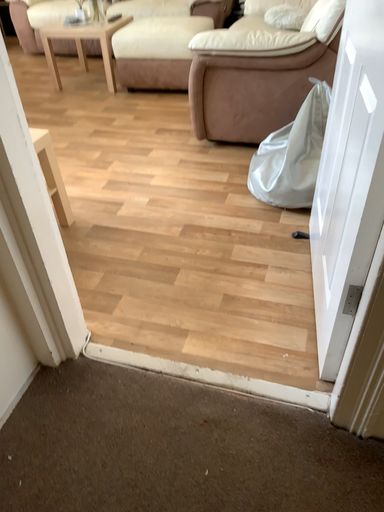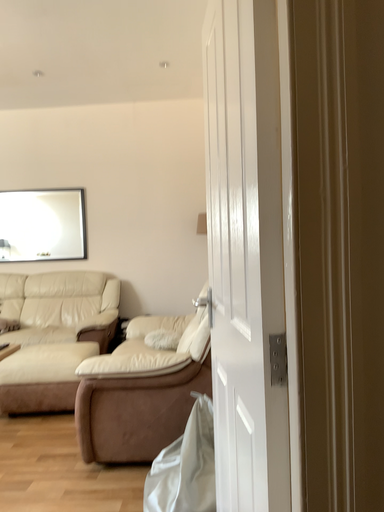
Question: Which way did the camera rotate in the video?

Choices:
 (A) rotated left
 (B) rotated right

Answer: (B)